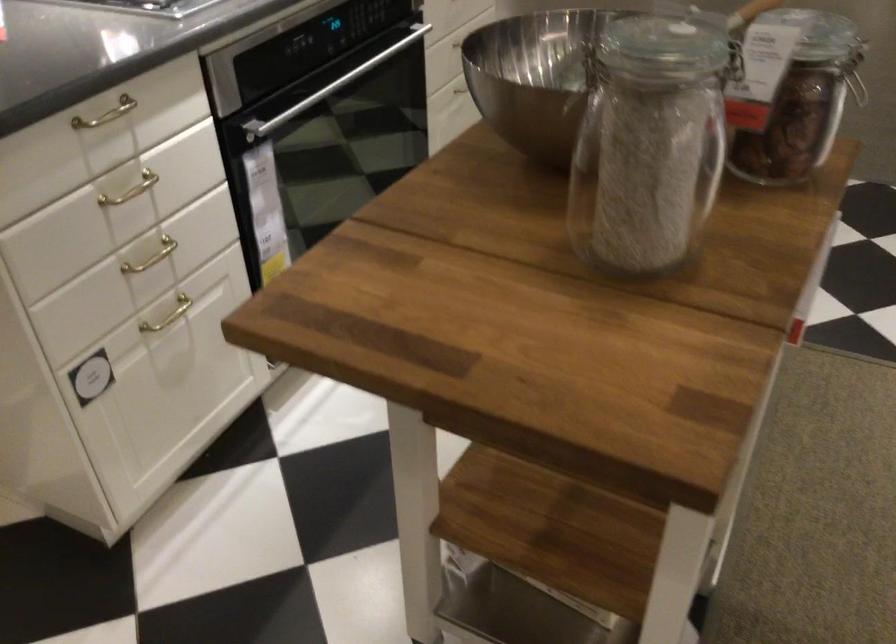
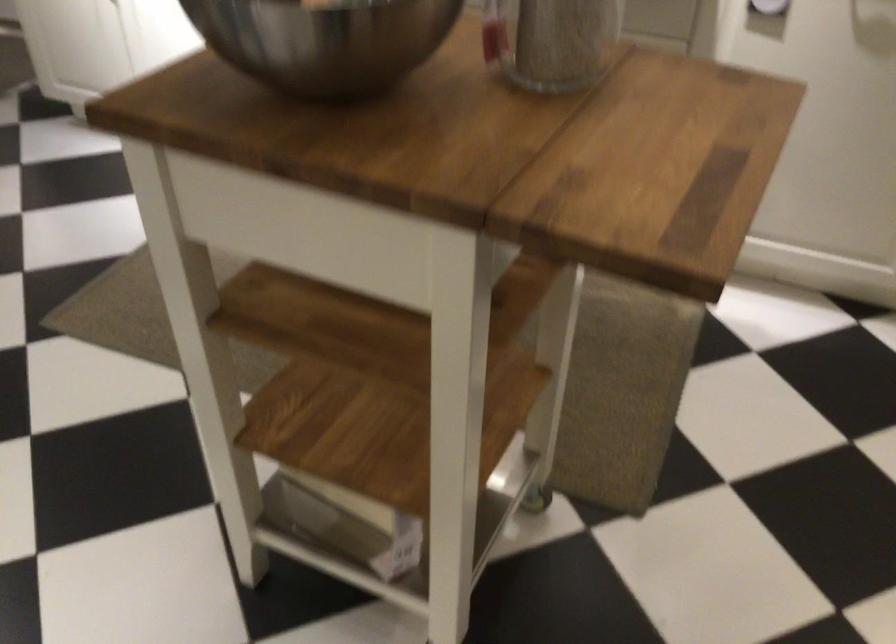
Find the pixel in the second image that matches (527,531) in the first image.

(352, 524)